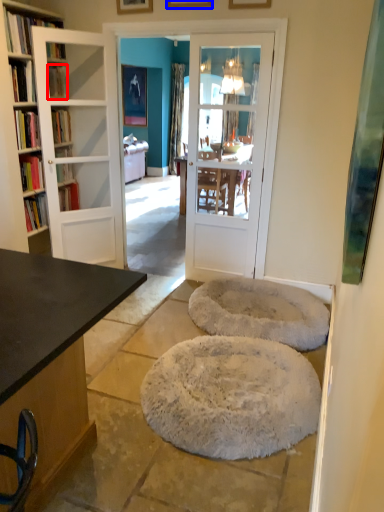
Question: Which point is closer to the camera, book (highlighted by a red box) or picture frame (highlighted by a blue box)?

Choices:
 (A) book
 (B) picture frame

Answer: (B)